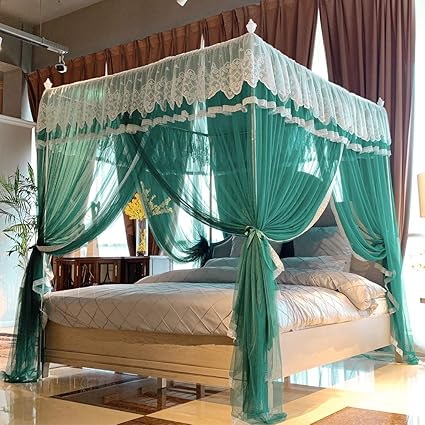
Identify the location of pillow. (328, 262).